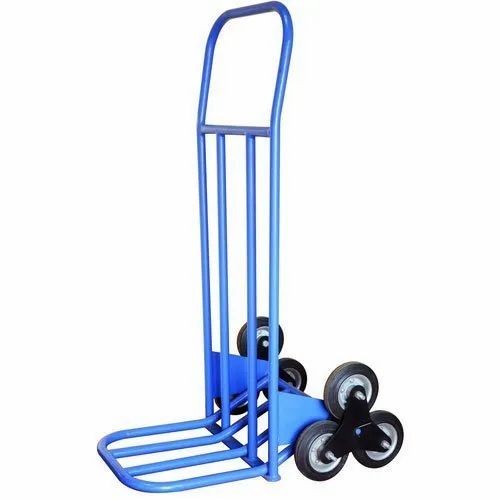
I want to click on handle, so click(x=239, y=14).